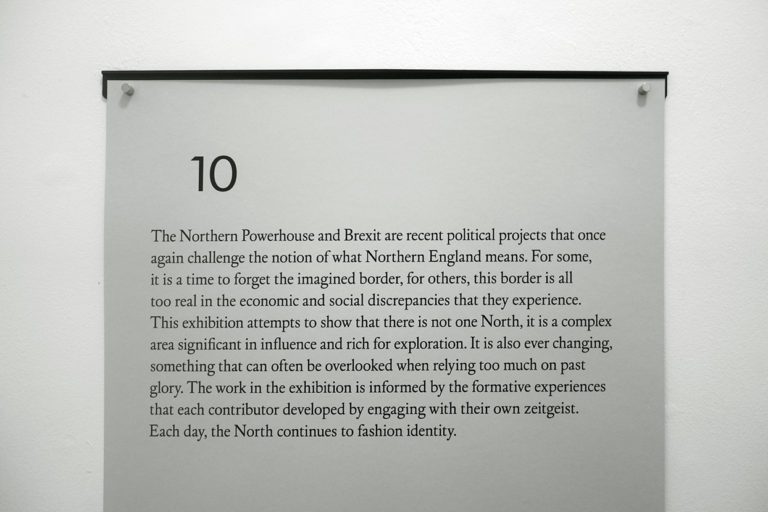
Image resolution: width=768 pixels, height=512 pixels. I want to click on white wall, so click(x=83, y=134).